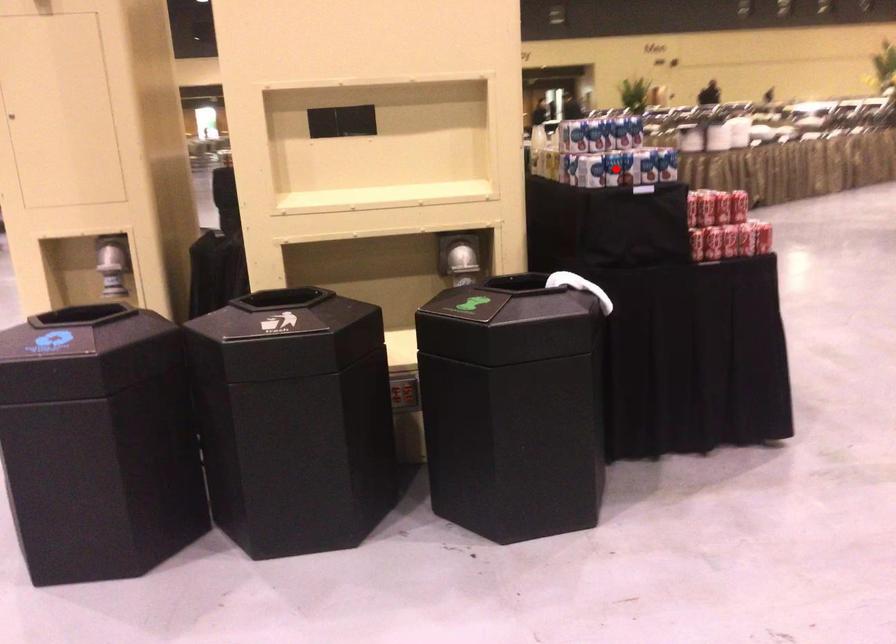
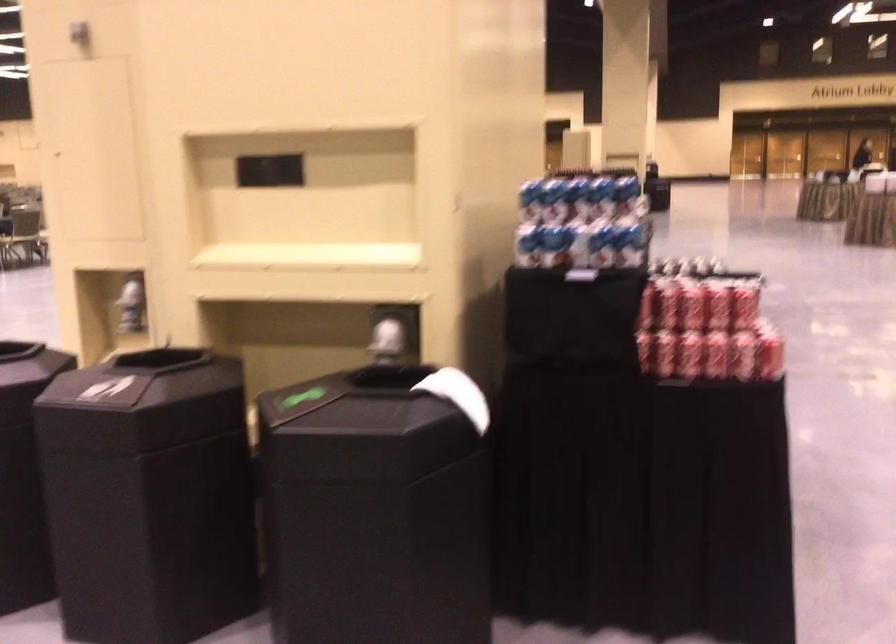
Question: I am providing you with two images of the same scene from different viewpoints. A red point is shown in image1. For the corresponding object point in image2, is it positioned nearer or farther from the camera?

Choices:
 (A) Nearer
 (B) Farther

Answer: (A)